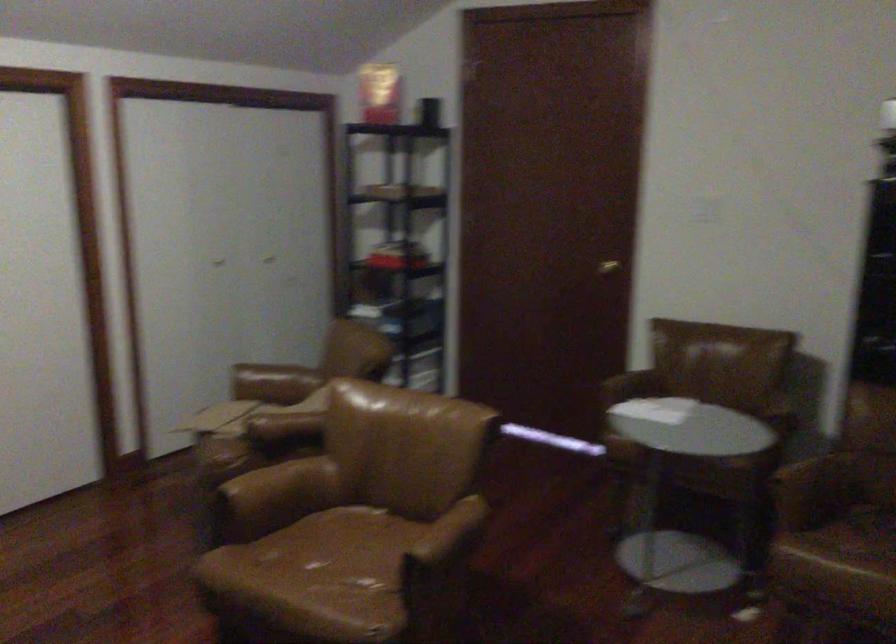
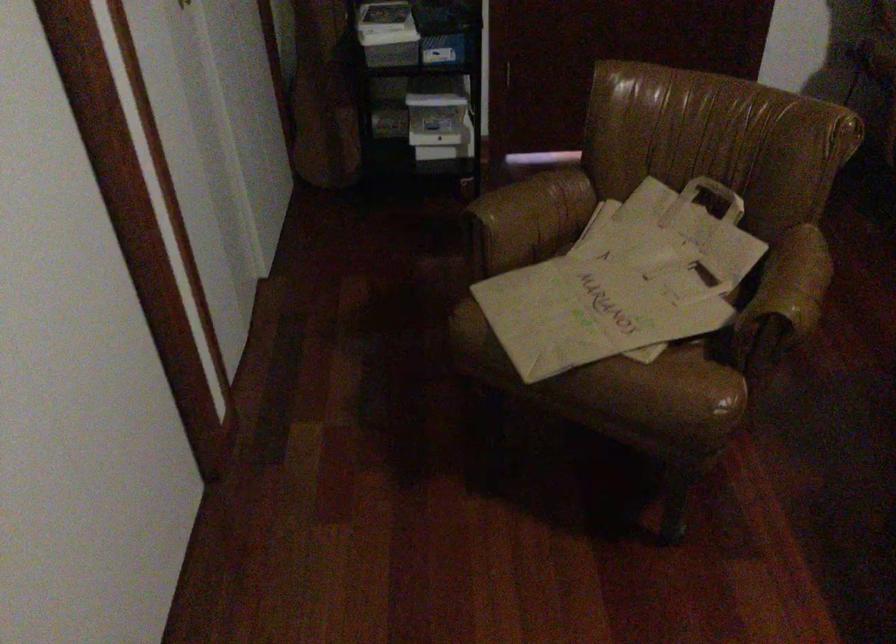
Locate, in the second image, the point that corresponds to pixel 271 379 in the first image.

(532, 216)